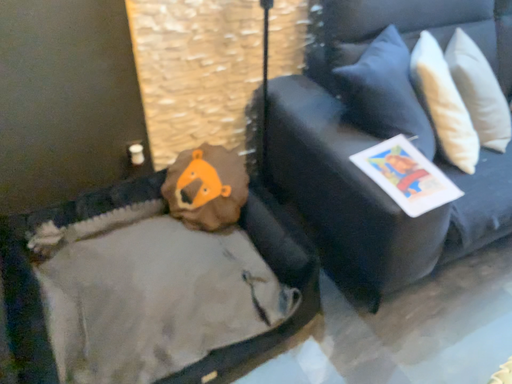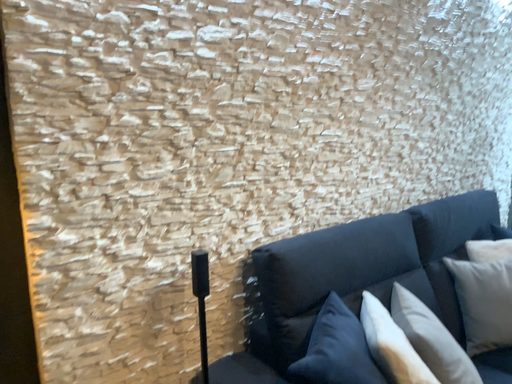
Question: How did the camera likely rotate when shooting the video?

Choices:
 (A) rotated upward
 (B) rotated downward

Answer: (A)